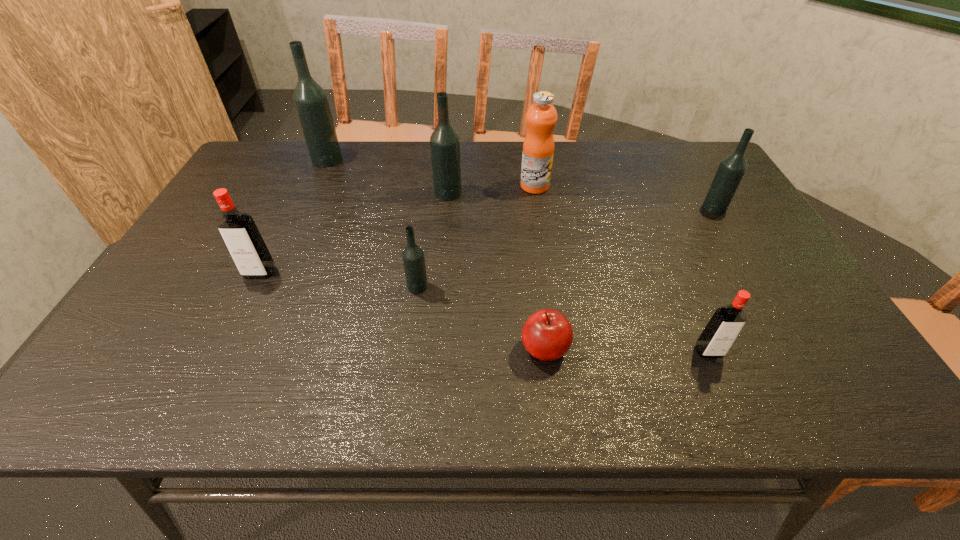
Identify which vodka is the fourth closest to the apple. Please provide its 2D coordinates. Your answer should be formatted as a tuple, i.e. [(x, y)], where the tuple contains the x and y coordinates of a point satisfying the conditions above.

[(238, 229)]

Find the location of a particular element. This screenshot has height=540, width=960. black vodka that can be found as the closest to the seventh object from left to right is located at coordinates (731, 170).

Identify which black vodka is the second closest to the rightmost object. Please provide its 2D coordinates. Your answer should be formatted as a tuple, i.e. [(x, y)], where the tuple contains the x and y coordinates of a point satisfying the conditions above.

[(413, 257)]

Locate an element on the screen. vacant region that satisfies the following two spatial constraints: 1. on the back side of the second biggest black vodka; 2. on the right side of the nearest black vodka is located at coordinates (430, 193).

Find the location of `blank space that satisfies the following two spatial constraints: 1. on the front and back of the apple; 2. on the right side of the farther red vodka`. blank space that satisfies the following two spatial constraints: 1. on the front and back of the apple; 2. on the right side of the farther red vodka is located at coordinates (223, 349).

Locate an element on the screen. Image resolution: width=960 pixels, height=540 pixels. vacant area in the image that satisfies the following two spatial constraints: 1. on the front side of the shortest object; 2. on the left side of the tallest vodka is located at coordinates (242, 349).